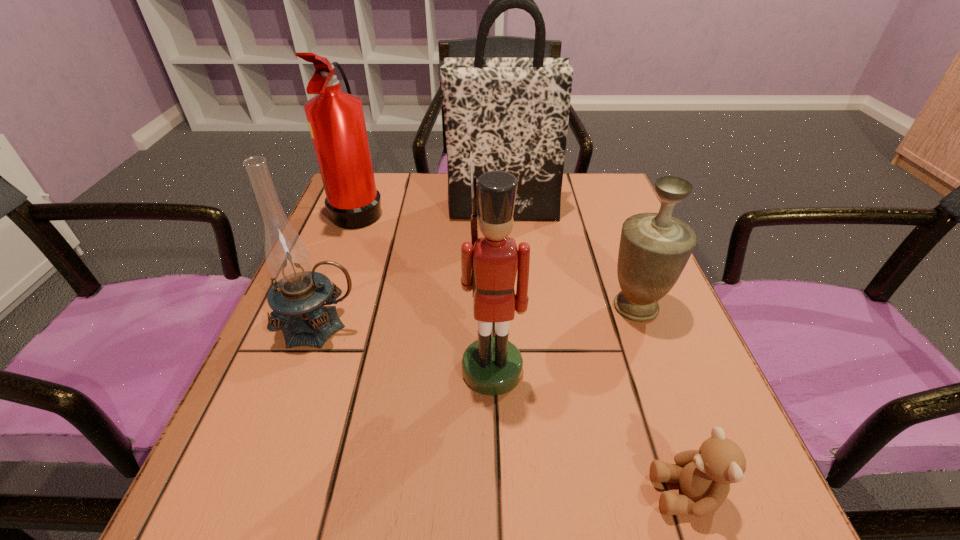
At what (x,y) coordinates should I click in order to perform the action: click on free space located 0.230m on the back of the oil lamp. Please return your answer as a coordinate pair (x, y). The width and height of the screenshot is (960, 540). Looking at the image, I should click on (354, 236).

At what (x,y) coordinates should I click in order to perform the action: click on vacant space located 0.320m on the left of the fifth tallest object. Please return your answer as a coordinate pair (x, y). Looking at the image, I should click on (437, 307).

At what (x,y) coordinates should I click in order to perform the action: click on free space located 0.220m on the front-facing side of the nearest object. Please return your answer as a coordinate pair (x, y). The height and width of the screenshot is (540, 960). Looking at the image, I should click on (487, 494).

Where is `free space located 0.220m on the front-facing side of the nearest object`? The height and width of the screenshot is (540, 960). free space located 0.220m on the front-facing side of the nearest object is located at coordinates (487, 494).

Identify the location of vacant region located 0.170m on the front-facing side of the nearest object. Image resolution: width=960 pixels, height=540 pixels. (524, 494).

Where is `shopping bag present at the far edge`? This screenshot has width=960, height=540. shopping bag present at the far edge is located at coordinates click(x=512, y=113).

Where is `fire extinguisher that is positioned at the far edge`? Image resolution: width=960 pixels, height=540 pixels. fire extinguisher that is positioned at the far edge is located at coordinates (336, 121).

Locate an element on the screen. This screenshot has width=960, height=540. object located in the near edge section of the desktop is located at coordinates (704, 475).

Where is `fire extinguisher present at the left edge`? Image resolution: width=960 pixels, height=540 pixels. fire extinguisher present at the left edge is located at coordinates (336, 121).

Locate an element on the screen. The height and width of the screenshot is (540, 960). oil lamp present at the left edge is located at coordinates [298, 295].